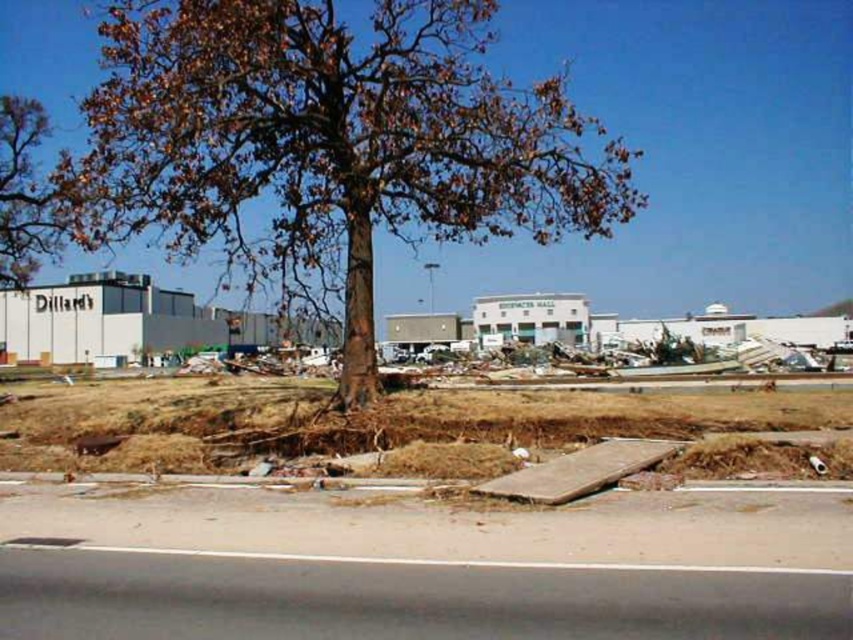
Who is taller, brown rough bark tree at center or brown leafy tree at upper left?

brown leafy tree at upper left is taller.

This screenshot has height=640, width=853. What are the coordinates of `brown rough bark tree at center` in the screenshot? It's located at (328, 145).

This screenshot has width=853, height=640. Identify the location of brown rough bark tree at center. (328, 145).